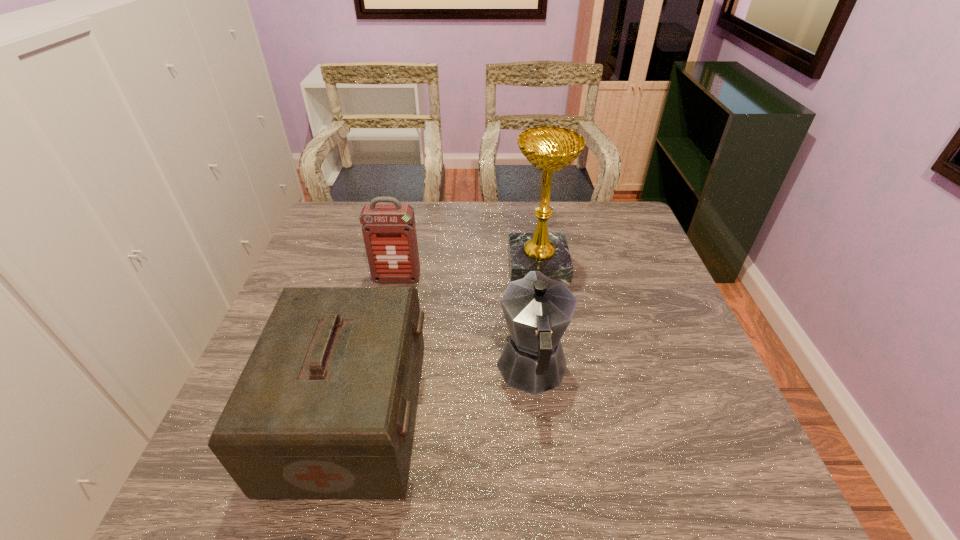
The width and height of the screenshot is (960, 540). I want to click on vacant position at the near right corner of the desktop, so click(709, 481).

Locate an element on the screen. The image size is (960, 540). free area in between the nearer first-aid kit and the coffeepot is located at coordinates (442, 393).

In order to click on free space between the award and the farther first-aid kit in this screenshot , I will do `click(468, 272)`.

Find the location of a particular element. This screenshot has height=540, width=960. free spot between the farther first-aid kit and the coffeepot is located at coordinates (465, 324).

The height and width of the screenshot is (540, 960). In order to click on free space between the nearer first-aid kit and the award in this screenshot , I will do `click(444, 341)`.

Where is `vacant point located between the coffeepot and the nearer first-aid kit`? vacant point located between the coffeepot and the nearer first-aid kit is located at coordinates (442, 393).

You are a GUI agent. You are given a task and a screenshot of the screen. Output one action in this format:
    pyautogui.click(x=<x>, y=<y>)
    Task: Click on the free space that is in between the coffeepot and the farther first-aid kit
    This screenshot has height=540, width=960.
    Given the screenshot: What is the action you would take?
    click(x=465, y=324)

Where is `empty location between the nearer first-aid kit and the coffeepot`? Image resolution: width=960 pixels, height=540 pixels. empty location between the nearer first-aid kit and the coffeepot is located at coordinates (442, 393).

Locate an element on the screen. The image size is (960, 540). free space between the tallest object and the nearer first-aid kit is located at coordinates point(444,341).

Where is `object identified as the closest to the nearer first-aid kit`? object identified as the closest to the nearer first-aid kit is located at coordinates (538, 310).